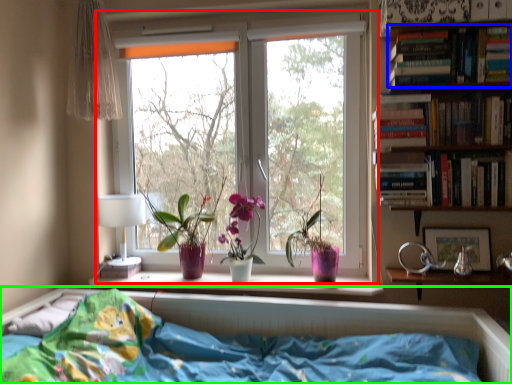
Question: Considering the real-world distances, which object is closest to window (highlighted by a red box)? book (highlighted by a blue box) or bed (highlighted by a green box).

Choices:
 (A) book
 (B) bed

Answer: (A)